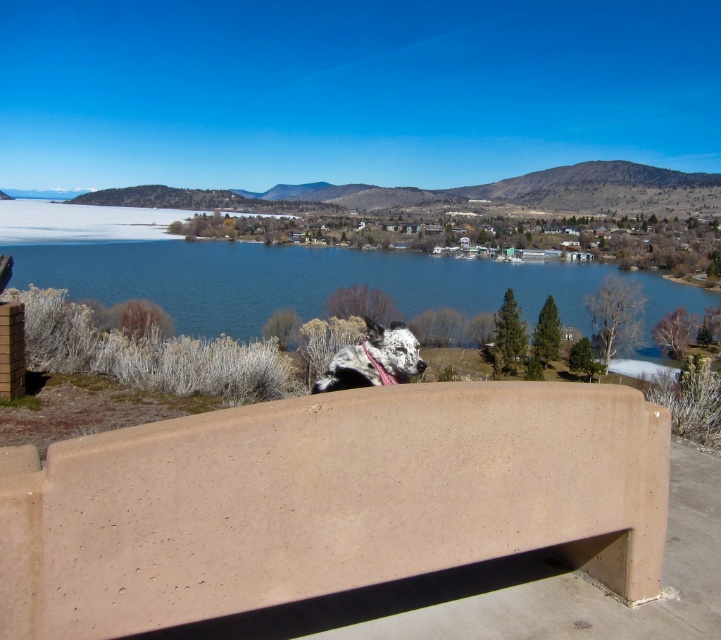
Can you confirm if matte concrete bench at center is wider than blue water at center?

No, matte concrete bench at center is not wider than blue water at center.

Is matte concrete bench at center bigger than blue water at center?

No.

Find the location of `matte concrete bench at center`. matte concrete bench at center is located at coordinates (327, 502).

At what (x,y) coordinates should I click in order to perform the action: click on matte concrete bench at center. Please return your answer as a coordinate pair (x, y). Looking at the image, I should click on coord(327,502).